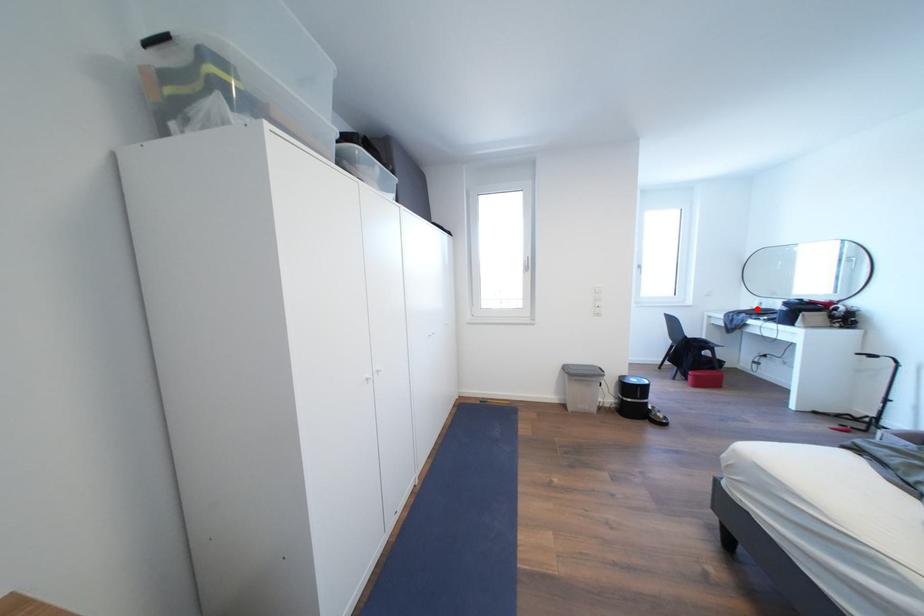
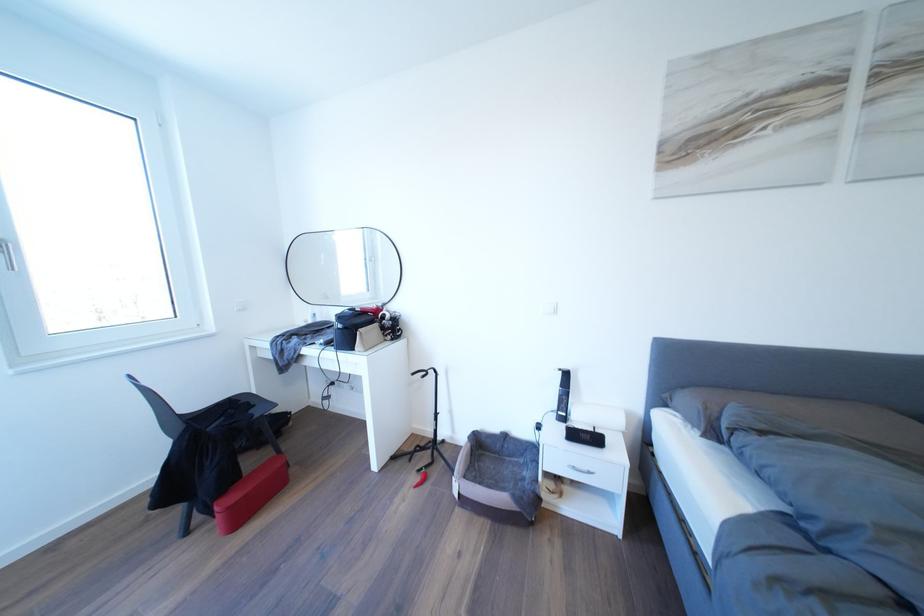
Question: A red point is marked in image1. In image2, is the corresponding 3D point closer to the camera or farther? Reply with the corresponding letter.

Choices:
 (A) The corresponding 3D point is closer.
 (B) The corresponding 3D point is farther.

Answer: (B)